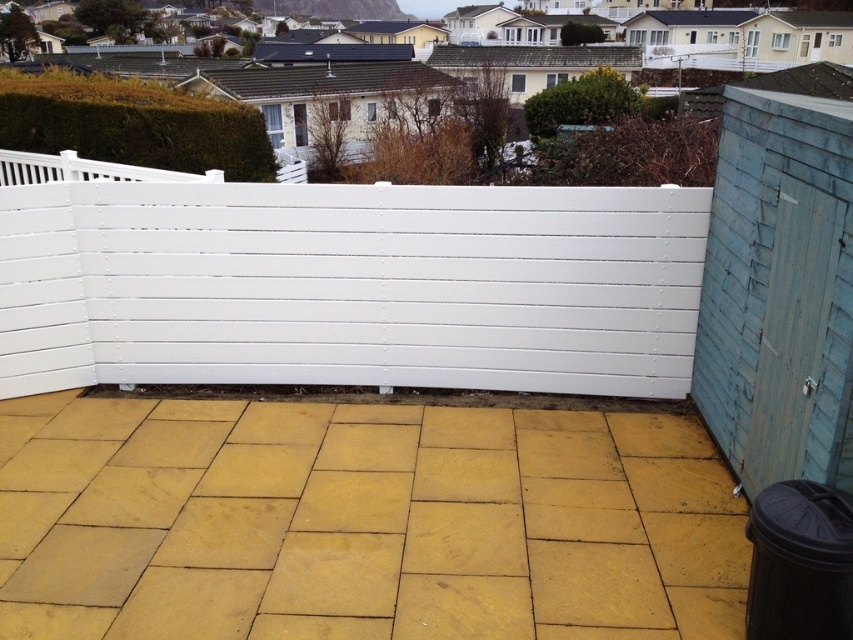
Question: Which point is closer to the camera?

Choices:
 (A) (370, 496)
 (B) (115, 561)
 (C) (778, 420)
 (D) (201, 278)

Answer: (B)

Question: Can you confirm if white painted wood fence at center is bigger than yellow stone tile at lower left?

Choices:
 (A) no
 (B) yes

Answer: (B)

Question: In this image, where is yellow stone tiles at center located relative to yellow stone tile at lower left?

Choices:
 (A) right
 (B) left

Answer: (A)

Question: Which object appears farthest from the camera in this image?

Choices:
 (A) yellow stone tiles at center
 (B) blue wooden shed at right
 (C) white painted wood fence at center
 (D) yellow stone tile at lower left

Answer: (C)

Question: Which point is closer to the camera taking this photo?

Choices:
 (A) (76, 525)
 (B) (792, 189)

Answer: (B)

Question: Does yellow stone tiles at center appear on the right side of blue wooden shed at right?

Choices:
 (A) yes
 (B) no

Answer: (B)